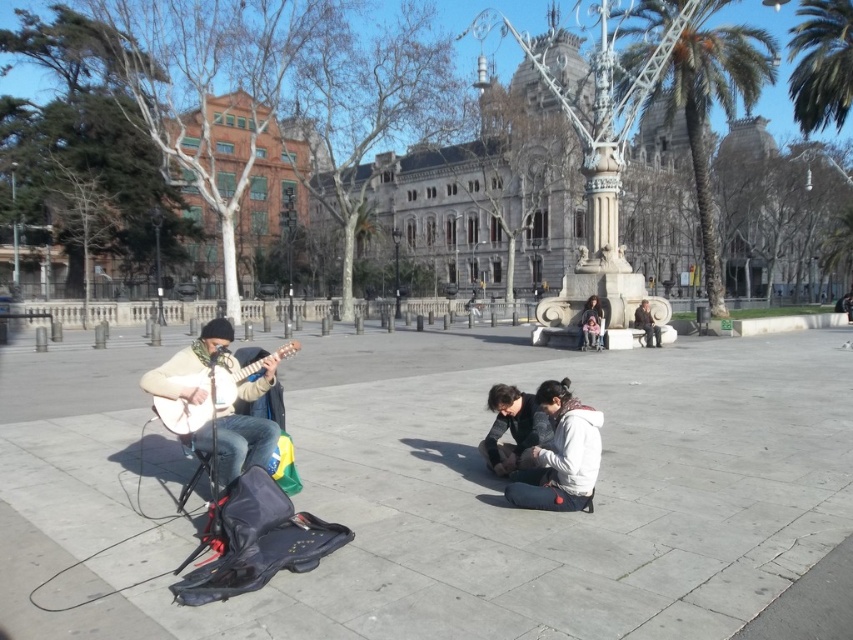
Question: Which point is closer to the camera?

Choices:
 (A) white matte jacket at center
 (B) matte black jacket at center

Answer: (A)

Question: Can you confirm if green leafy palm tree at upper right is positioned to the left of matte black jacket at center?

Choices:
 (A) no
 (B) yes

Answer: (A)

Question: Which point is closer to the camera taking this photo?

Choices:
 (A) (190, 397)
 (B) (549, 477)
 (C) (642, 320)

Answer: (A)

Question: Is green leafy palm tree at upper right wider than dark gray fabric jacket at center?

Choices:
 (A) no
 (B) yes

Answer: (B)

Question: Is white matte jacket at center in front of matte black jacket at center?

Choices:
 (A) no
 (B) yes

Answer: (B)

Question: Which point is closer to the camera taking this photo?

Choices:
 (A) (593, 324)
 (B) (207, 397)

Answer: (B)